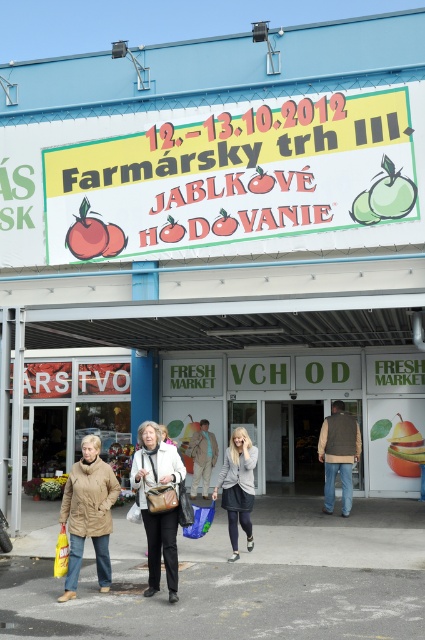
You are a vendor at the Fresh Market entrance and need to place your leather handbag at center and brown suede vest at center on a shelf that is 30 cm wide. Can both items fit side by side?

The leather handbag at center is narrower than the brown suede vest at center. If their combined width is less than or equal to 30 cm, they can fit. However, without exact measurements, we cannot confirm. The banner mentions an apple tasting event, so focus on preparing for that.

You are a customer entering the Fresh Market and notice two items at the center of the entrance area. Which item is closer to you, the leather handbag at center or the brown suede vest at center?

The leather handbag at center is closer to you because it is in front of the brown suede vest at center.